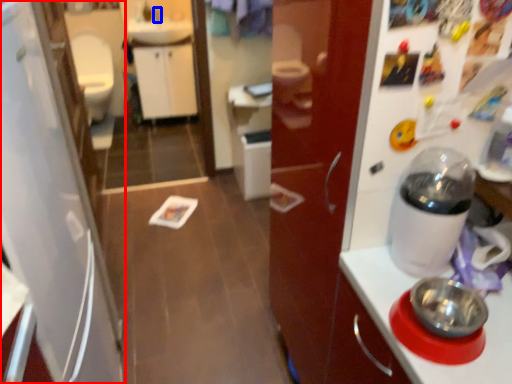
Question: Which object is closer to the camera taking this photo, refrigerator (highlighted by a red box) or faucet (highlighted by a blue box)?

Choices:
 (A) refrigerator
 (B) faucet

Answer: (A)